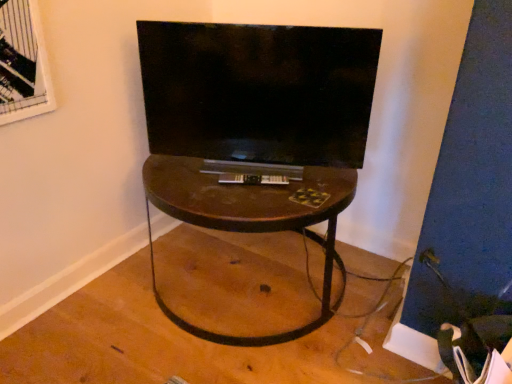
The height and width of the screenshot is (384, 512). In order to click on vacant region below matte black tv at center (from a real-world perspective) in this screenshot , I will do `click(247, 162)`.